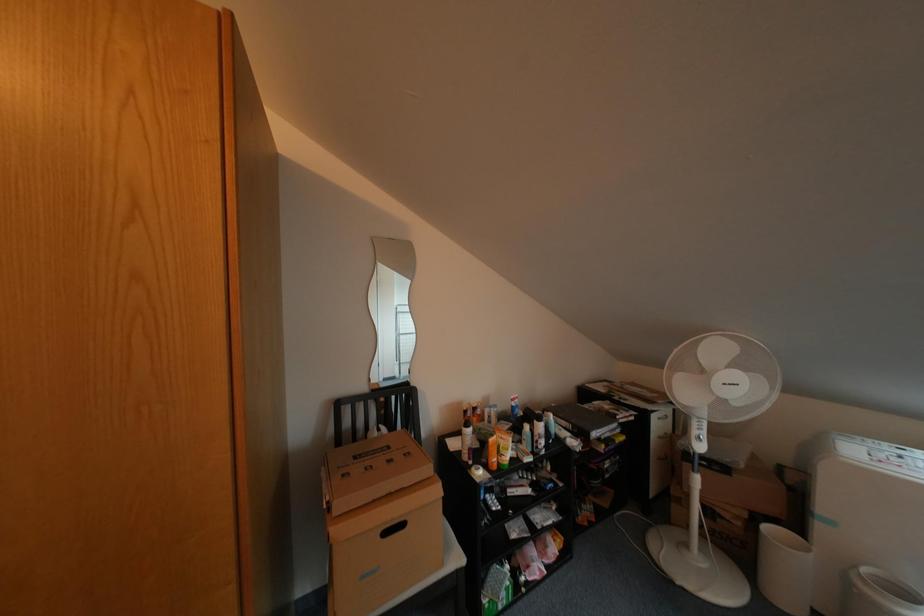
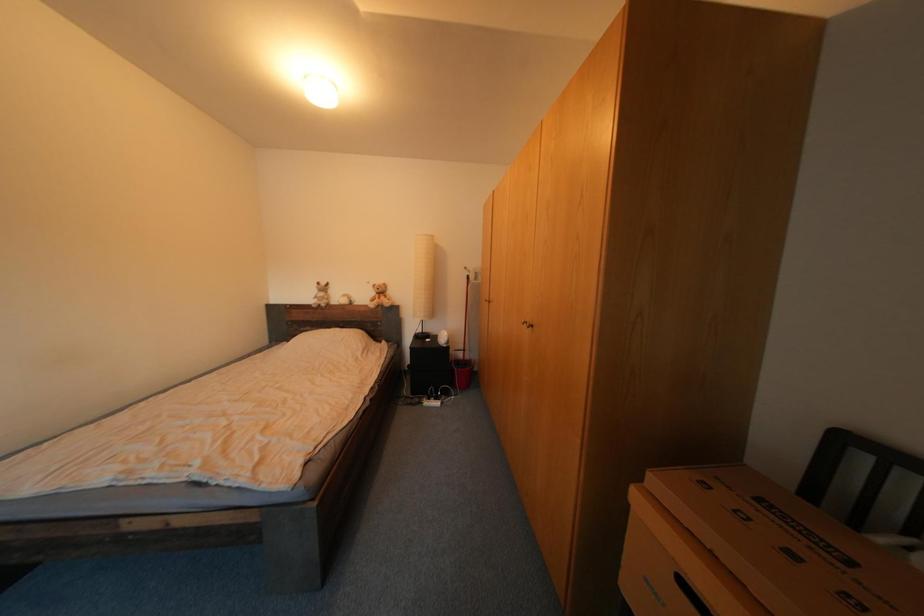
Question: The first image is from the beginning of the video and the second image is from the end. How did the camera likely rotate when shooting the video?

Choices:
 (A) Left
 (B) Right
 (C) Up
 (D) Down

Answer: (A)